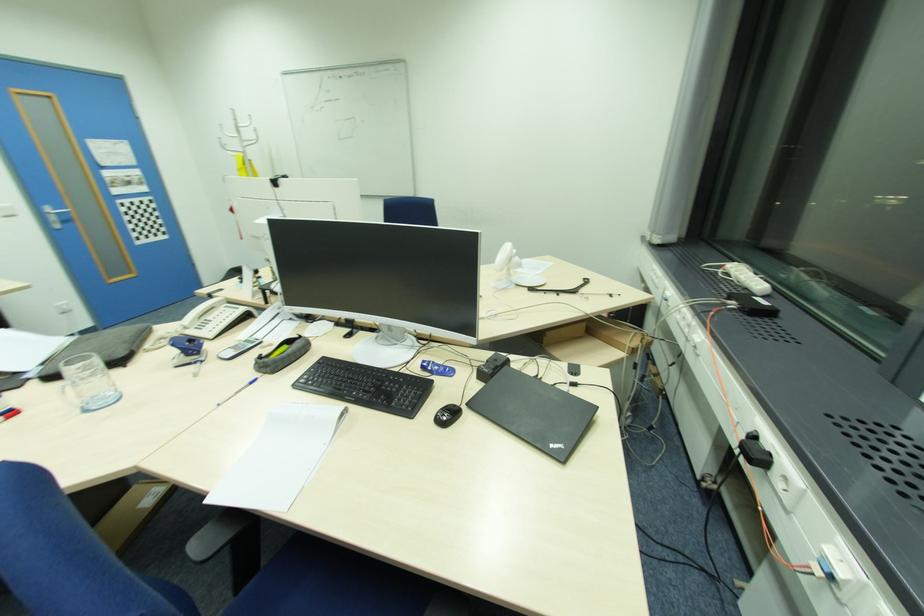
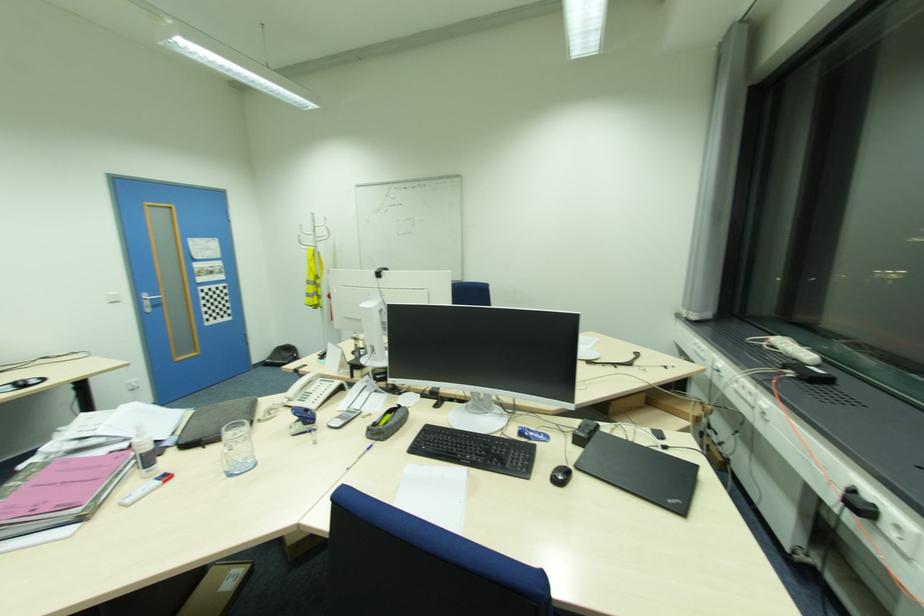
In the scene shown: Which direction would the cameraman need to move to produce the second image?

The cameraman walked toward left, backward.